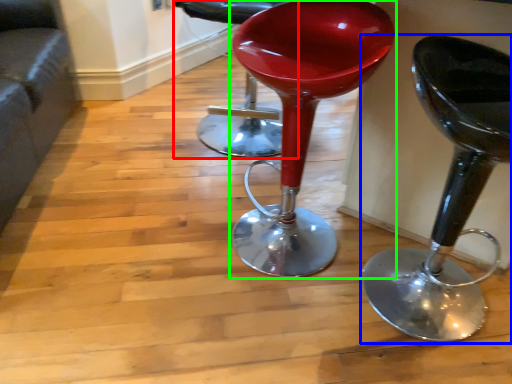
Question: Which object is positioned farthest from chair (highlighted by a red box)? Select from stool (highlighted by a blue box) and stool (highlighted by a green box).

Choices:
 (A) stool
 (B) stool

Answer: (A)